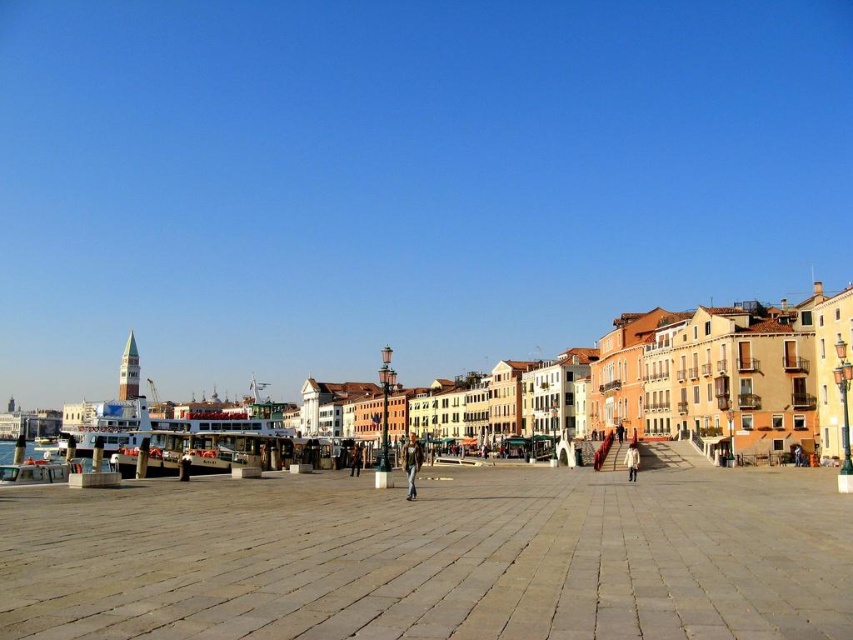
You are standing on the light brown stone pavement at center and want to walk to the point marked at coordinates (434, 557). Which direction should you head?

The point marked at coordinates (434, 557) is located on the light brown stone pavement at center, so you are already at that point.

You are a tourist standing on the light brown stone pavement at center and want to take a photo of the matte orange building at center. If your camera can focus up to 30 meters, will you be able to capture the building clearly?

The distance between the light brown stone pavement at center and the matte orange building at center is 35.34 meters, which exceeds the camera focus limit of 30 meters. Therefore, the camera will not be able to capture the matte orange building at center clearly.

You are an architect planning to redesign the waterfront area. You need to know which area is smaller in size between the light brown stone pavement at center and the matte orange building at center. Which one should you consider for a small garden?

The light brown stone pavement at center occupies less space than the matte orange building at center, so it should be considered for a small garden.